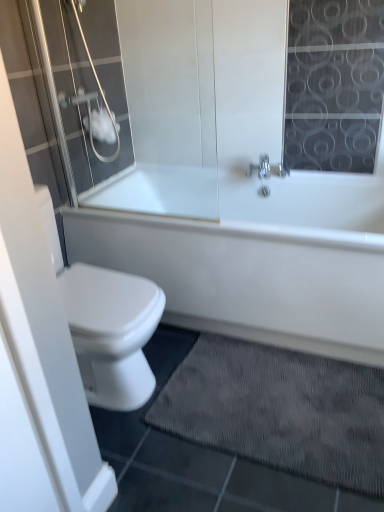
Question: From the image's perspective, is white matte toilet paper at upper left above or below white glossy bathtub at center?

Choices:
 (A) above
 (B) below

Answer: (A)

Question: In the image, is white matte toilet paper at upper left positioned in front of or behind white glossy bathtub at center?

Choices:
 (A) front
 (B) behind

Answer: (B)

Question: Which is nearer to the transparent glass shower door at upper left?

Choices:
 (A) dark gray textured bath mat at lower center
 (B) white glossy bathtub at center
 (C) white matte toilet paper at upper left

Answer: (C)

Question: Based on their relative distances, which object is nearer to the white glossy bathtub at center?

Choices:
 (A) dark gray textured bath mat at lower center
 (B) transparent glass shower door at upper left
 (C) white matte toilet paper at upper left

Answer: (A)